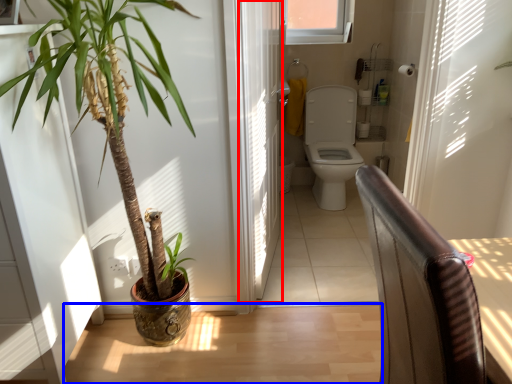
Question: Which point is closer to the camera, screen door (highlighted by a red box) or path (highlighted by a blue box)?

Choices:
 (A) screen door
 (B) path

Answer: (A)